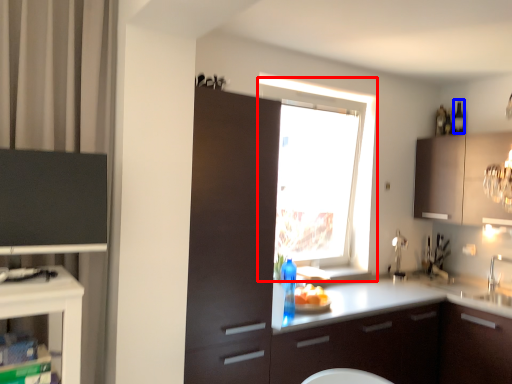
Question: Which of the following is the farthest to the observer, window (highlighted by a red box) or bottle (highlighted by a blue box)?

Choices:
 (A) window
 (B) bottle

Answer: (B)